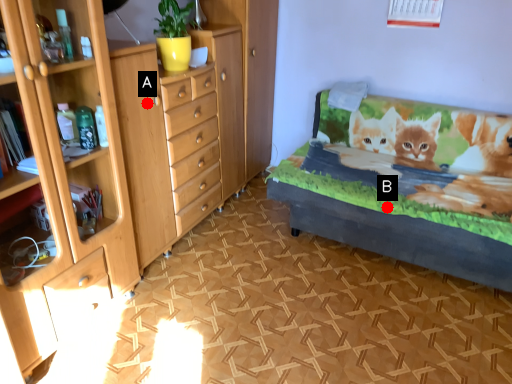
Question: Two points are circled on the image, labeled by A and B beside each circle. Which point appears closest to the camera in this image?

Choices:
 (A) A is closer
 (B) B is closer

Answer: (A)